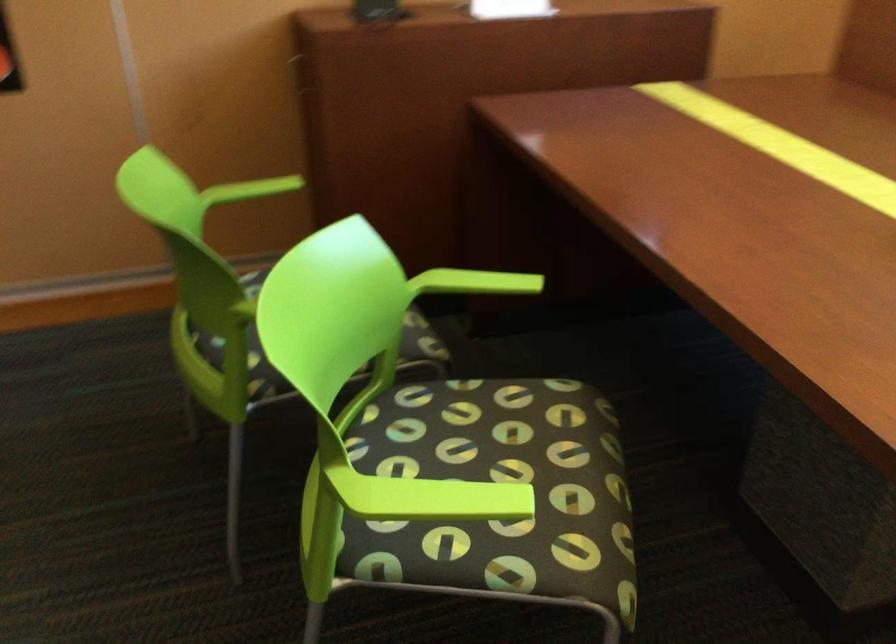
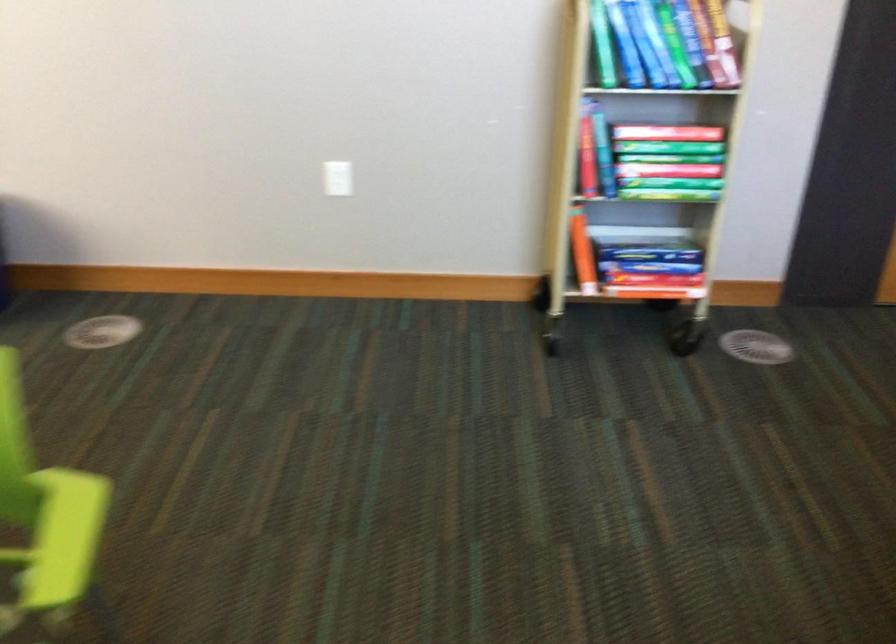
The first image is from the beginning of the video and the second image is from the end. How did the camera likely rotate when shooting the video?

The rotation direction of the camera is left-down.